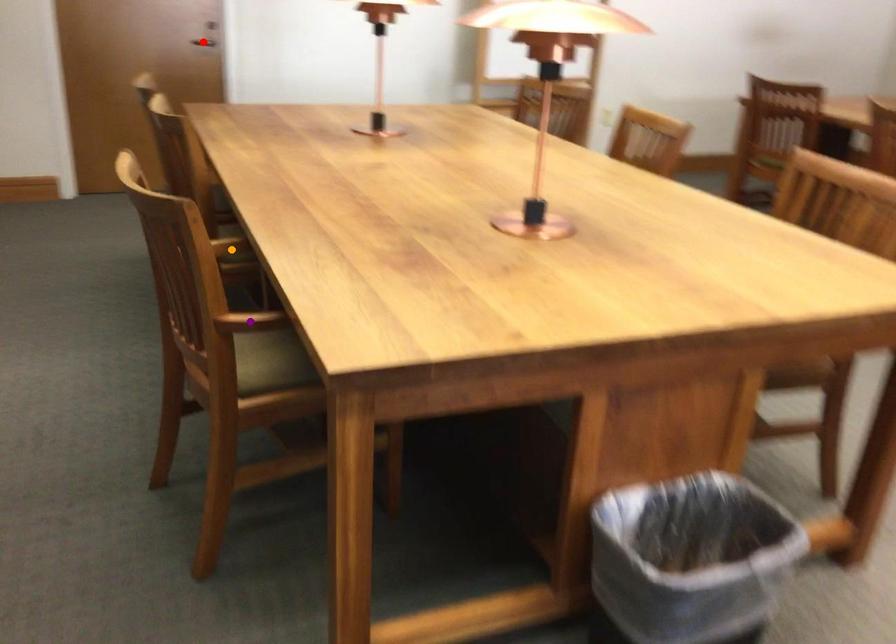
Based on the photo, order these from nearest to farthest:
red point
orange point
purple point

red point, orange point, purple point